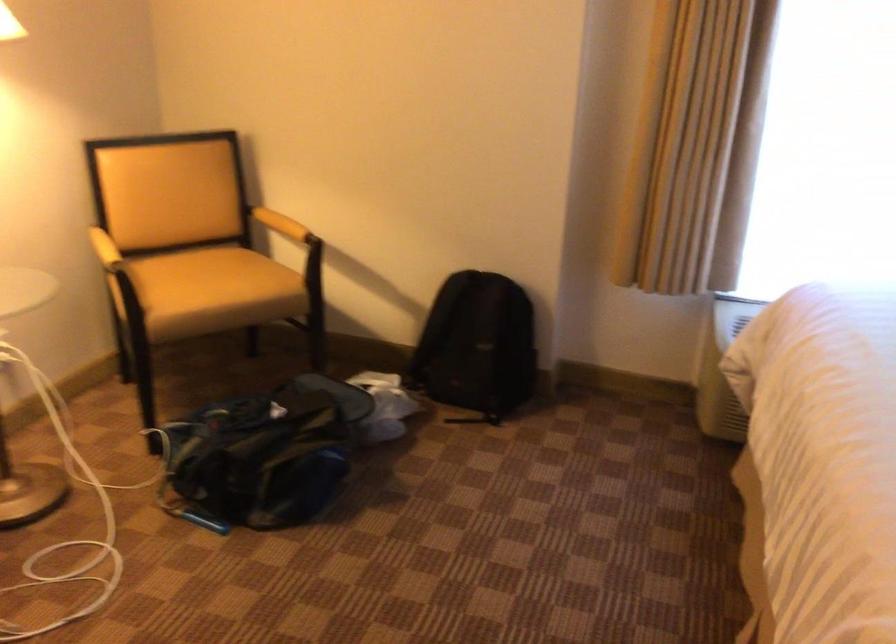
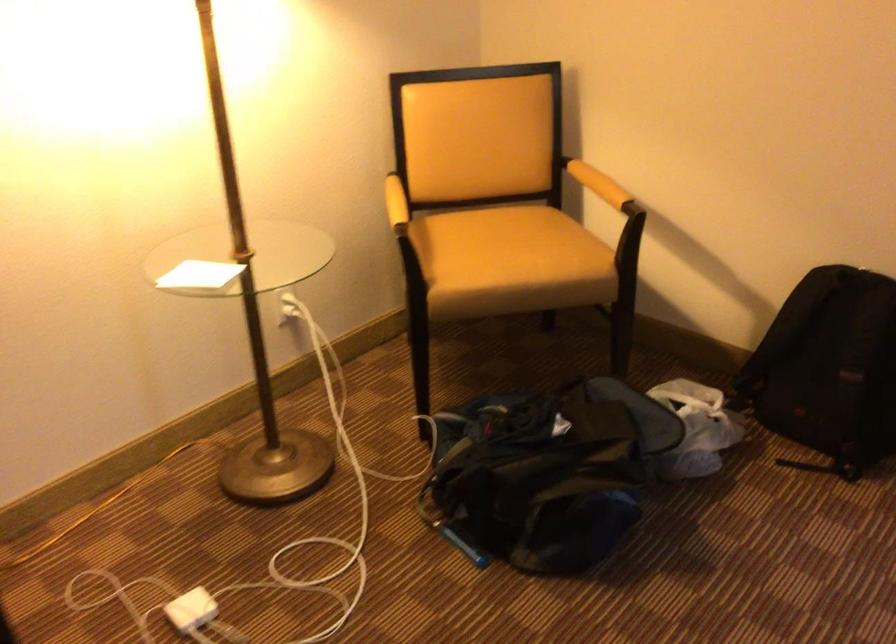
Locate, in the second image, the point that corresponds to point (110, 240) in the first image.

(395, 203)